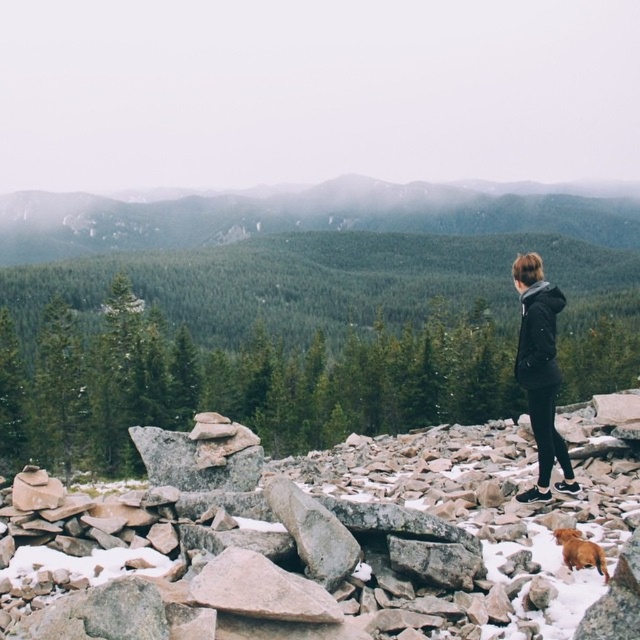
You are a geologist analyzing the composition of rocks in the image. You notice a smooth gray rock at center. Based on its position in the image, what are the coordinates of its location?

The smooth gray rock at center is located at coordinates (326, 548).